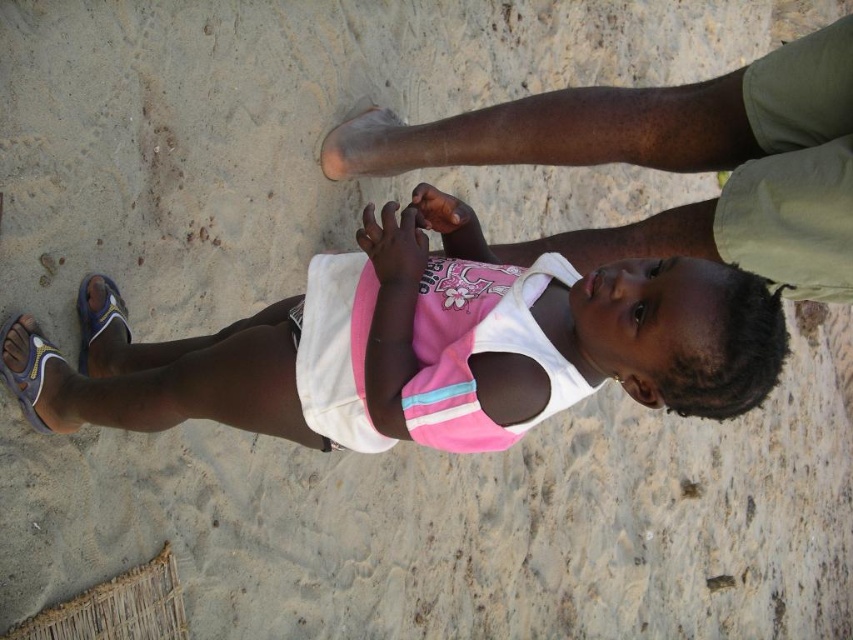
Question: Is the position of yellow-green rubber sandal at lower left less distant than that of blue fabric sandal at lower left?

Choices:
 (A) no
 (B) yes

Answer: (B)

Question: Which object is the closest to the green cotton shorts at upper right?

Choices:
 (A) blue fabric sandal at lower left
 (B) pink fabric shirt at center

Answer: (B)

Question: Which point is farther to the camera?

Choices:
 (A) green cotton shorts at upper right
 (B) yellow-green rubber sandal at lower left
 (C) pink fabric shirt at center

Answer: (B)

Question: Which point is closer to the camera?

Choices:
 (A) green cotton shorts at upper right
 (B) blue fabric sandal at lower left
 (C) yellow-green rubber sandal at lower left
 (D) pink fabric shirt at center

Answer: (D)

Question: Observing the image, what is the correct spatial positioning of pink fabric shirt at center in reference to blue fabric sandal at lower left?

Choices:
 (A) above
 (B) below

Answer: (A)

Question: Is the position of yellow-green rubber sandal at lower left more distant than that of blue fabric sandal at lower left?

Choices:
 (A) yes
 (B) no

Answer: (B)